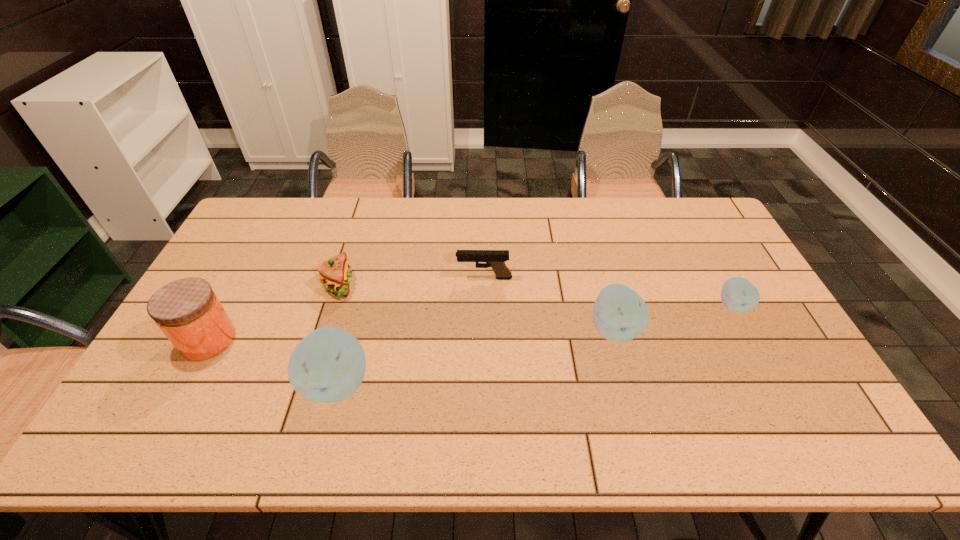
Locate an element on the screen. The image size is (960, 540). vacant spot for a new apple to ensure equal spacing is located at coordinates (483, 354).